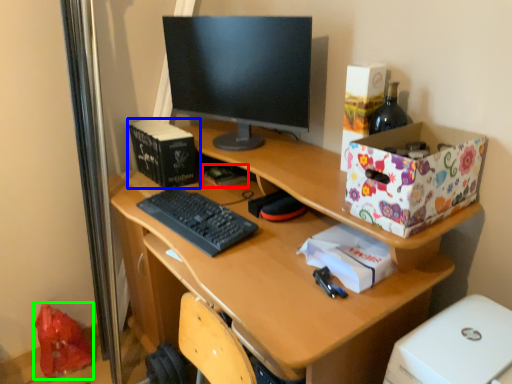
Question: Which object is positioned farthest from book (highlighted by a red box)? Select from book (highlighted by a blue box) and shopping bag (highlighted by a green box).

Choices:
 (A) book
 (B) shopping bag

Answer: (B)